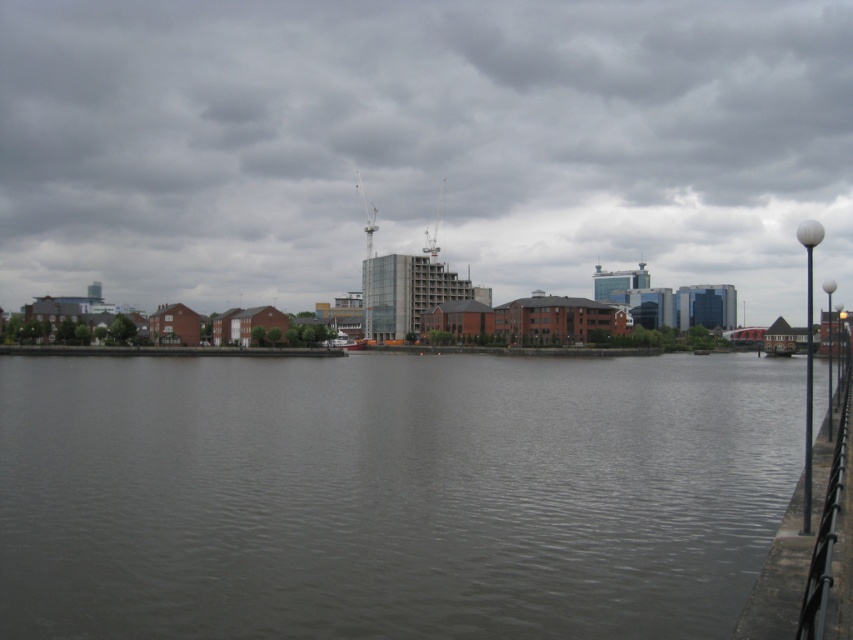
You are standing at the point marked by the coordinates point [421,145] in the waterfront scene. What type of buildings are directly in front of you?

The point [421,145] indicates transparent glass buildings at center, so the buildings directly in front of you are transparent glass buildings at center.